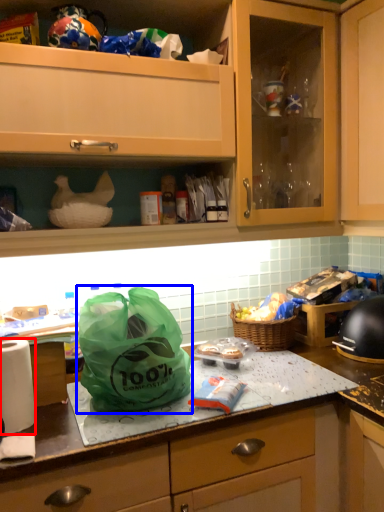
Question: Among these objects, which one is farthest to the camera, kitchen appliance (highlighted by a red box) or plastic bag (highlighted by a blue box)?

Choices:
 (A) kitchen appliance
 (B) plastic bag

Answer: (A)